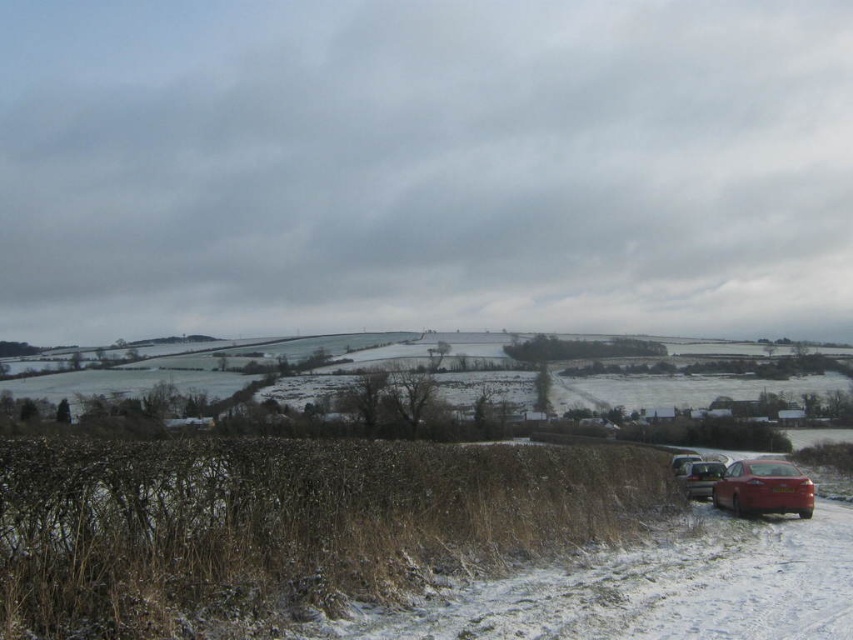
Please use the coordinate system where the bottom left corner is the origin point. The smooth asphalt road at lower right is located at which coordinate point?

The smooth asphalt road at lower right is located at coordinate point (283, 524).

In the scene shown: You are a delivery driver who needs to park your truck between the shiny red car at lower right and the metallic silver car at lower right. Is there enough space between them for your truck that is 6 meters long?

The shiny red car at lower right is bigger than metallic silver car at lower right, but the exact distance between them is not provided. Therefore, it is uncertain if there is enough space for the truck.

From the picture: You are a delivery driver who needs to park your metallic silver car at lower right on the smooth asphalt road at lower right. Can you park there without blocking the road?

The smooth asphalt road at lower right is positioned over the metallic silver car at lower right, meaning the car is already parked on the road. Since the road is covered by the car, parking there would block the road. Choose an alternative spot.